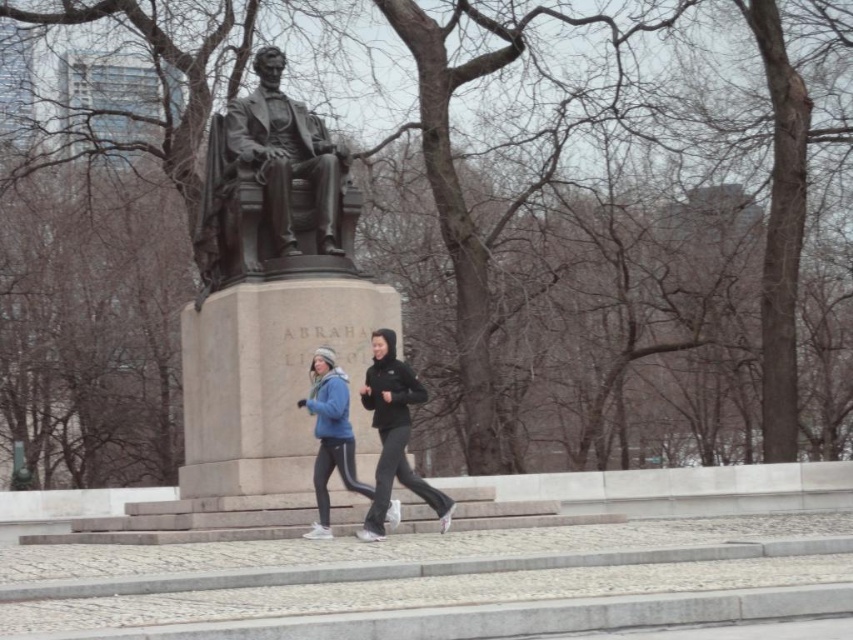
Is bronze statue at center shorter than matte blue jacket at center?

No, bronze statue at center is not shorter than matte blue jacket at center.

Where is `bronze statue at center`? bronze statue at center is located at coordinates (283, 154).